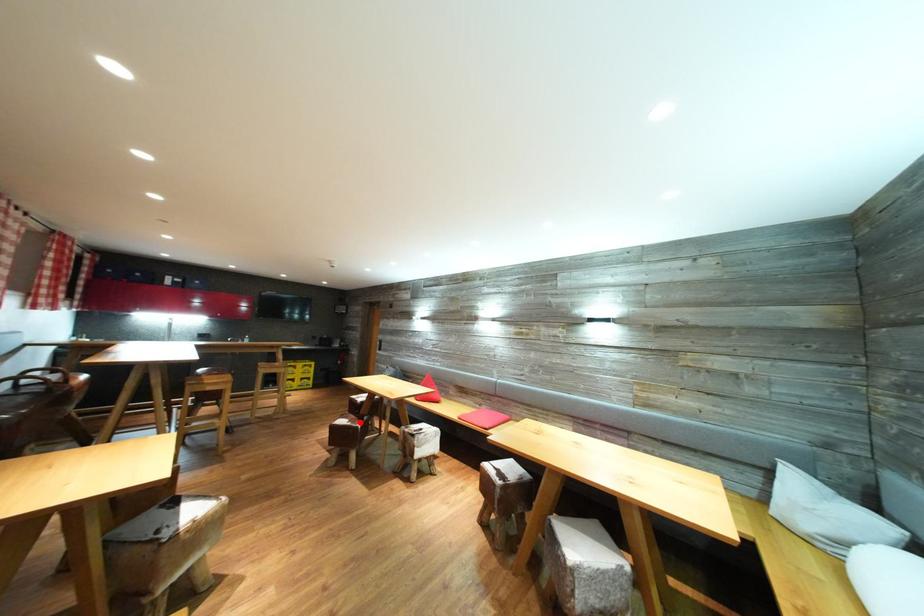
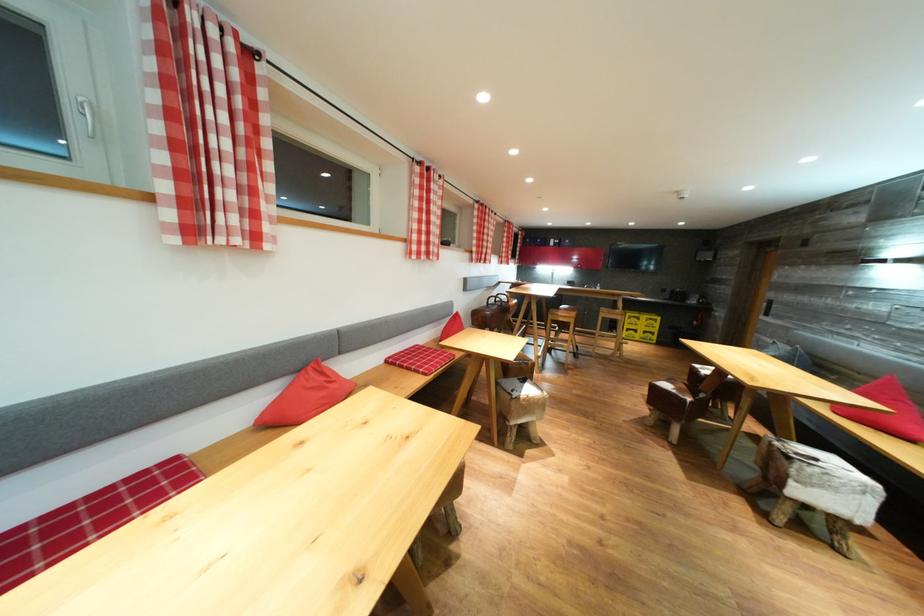
Question: I am providing you with two images of the same scene from different viewpoints. A red point is shown in image1. For the corresponding object point in image2, is it positioned nearer or farther from the camera?

Choices:
 (A) Nearer
 (B) Farther

Answer: (A)